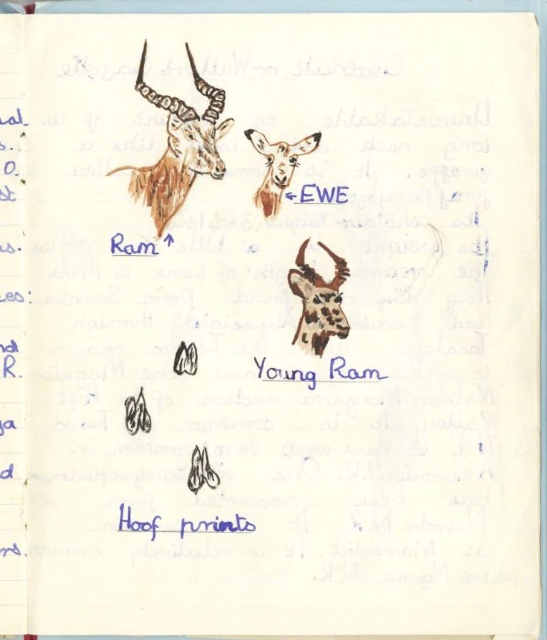
Question: Which object appears farthest from the camera in this image?

Choices:
 (A) brown textured ram at upper left
 (B) speckled fur young ram at center

Answer: (B)

Question: Which object appears closest to the camera in this image?

Choices:
 (A) brown textured ram at upper left
 (B) brown textured head at upper center
 (C) speckled fur young ram at center

Answer: (A)

Question: Can you confirm if brown textured ram at upper left is positioned to the right of brown textured head at upper center?

Choices:
 (A) yes
 (B) no

Answer: (B)

Question: Which object is closer to the camera taking this photo?

Choices:
 (A) brown textured head at upper center
 (B) speckled fur young ram at center

Answer: (A)

Question: Is speckled fur young ram at center closer to camera compared to brown textured head at upper center?

Choices:
 (A) yes
 (B) no

Answer: (B)

Question: Is speckled fur young ram at center to the left of brown textured head at upper center from the viewer's perspective?

Choices:
 (A) yes
 (B) no

Answer: (B)